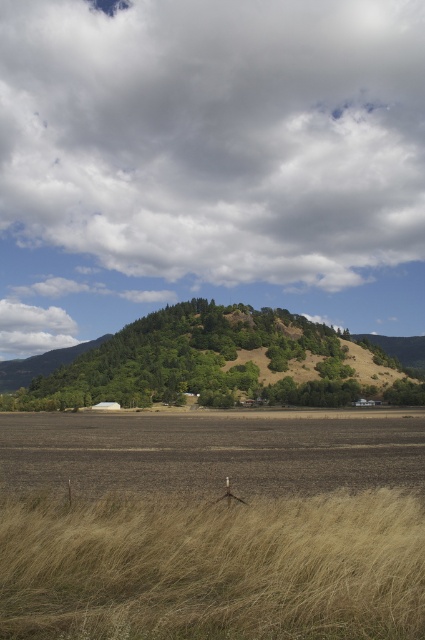
Is cloudy sky at upper center smaller than brown soil at center?

No, cloudy sky at upper center is not smaller than brown soil at center.

Is point (385, 177) positioned before point (158, 436)?

No, it is behind (158, 436).

Image resolution: width=425 pixels, height=640 pixels. In order to click on cloudy sky at upper center in this screenshot , I will do `click(215, 134)`.

Which is in front, point (98, 225) or point (376, 600)?

Positioned in front is point (376, 600).

Is cloudy sky at upper center taller than dry grass at lower left?

Indeed, cloudy sky at upper center has a greater height compared to dry grass at lower left.

Is point (359, 8) positioned before point (240, 580)?

No, it is not.

At what (x,y) coordinates should I click in order to perform the action: click on cloudy sky at upper center. Please return your answer as a coordinate pair (x, y). Looking at the image, I should click on (215, 134).

Who is positioned more to the left, dry grass at lower left or brown soil at center?

brown soil at center

Who is more forward, (102, 538) or (107, 432)?

Point (102, 538) is more forward.

What do you see at coordinates (214, 566) in the screenshot? I see `dry grass at lower left` at bounding box center [214, 566].

This screenshot has height=640, width=425. I want to click on dry grass at lower left, so click(214, 566).